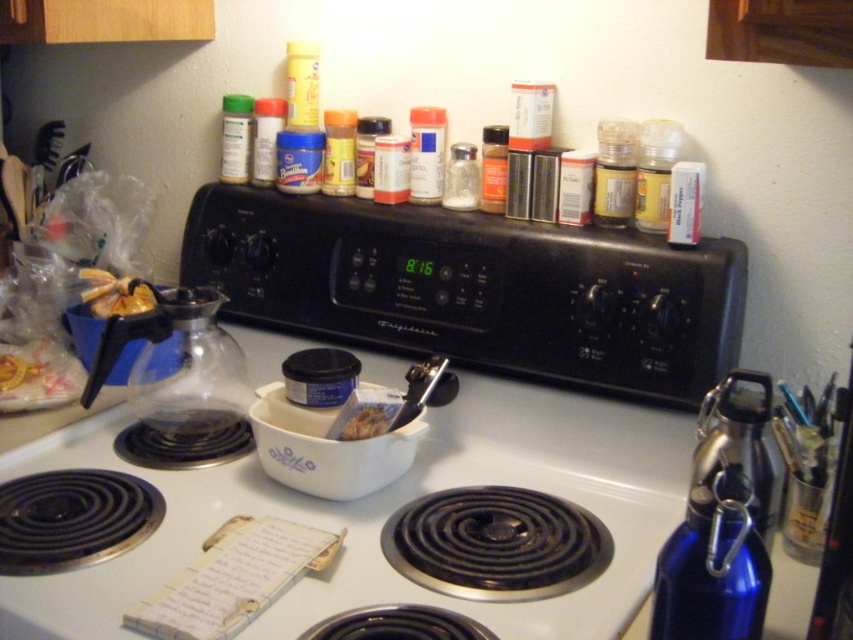
Between white matte countertop at center and matte glass spice jar at upper right, which one is positioned lower?

white matte countertop at center

Does white matte countertop at center have a greater width compared to matte glass spice jar at upper right?

Indeed, white matte countertop at center has a greater width compared to matte glass spice jar at upper right.

Which is behind, point (550, 442) or point (611, 180)?

Positioned behind is point (550, 442).

The image size is (853, 640). Find the location of `white matte countertop at center`. white matte countertop at center is located at coordinates (387, 515).

Can you confirm if transparent glass carafe at center is bigger than brown crumbly food at center?

Yes.

Identify the location of transparent glass carafe at center. This screenshot has width=853, height=640. (190, 369).

Consider the image. Which is above, black plastic stove at upper center or yellow plastic bottle at upper right?

Positioned higher is yellow plastic bottle at upper right.

Identify the location of black plastic stove at upper center. (476, 289).

Image resolution: width=853 pixels, height=640 pixels. I want to click on black plastic stove at upper center, so click(x=476, y=289).